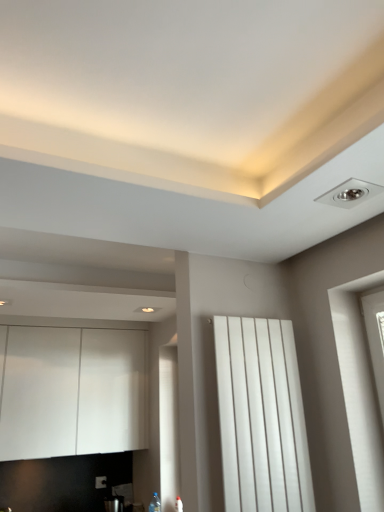
Question: Do you think white matte radiator at center is within white matte cabinet at left, or outside of it?

Choices:
 (A) inside
 (B) outside

Answer: (B)

Question: Is point (264, 428) positioned closer to the camera than point (3, 443)?

Choices:
 (A) farther
 (B) closer

Answer: (B)

Question: Looking at their shapes, would you say white matte radiator at center is wider or thinner than white matte cabinet at left?

Choices:
 (A) wide
 (B) thin

Answer: (B)

Question: Considering the positions of white matte cabinet at left and white matte radiator at center in the image, is white matte cabinet at left wider or thinner than white matte radiator at center?

Choices:
 (A) thin
 (B) wide

Answer: (B)

Question: Is white matte cabinet at left bigger or smaller than white matte radiator at center?

Choices:
 (A) big
 (B) small

Answer: (A)

Question: Is white matte cabinet at left inside or outside of white matte radiator at center?

Choices:
 (A) inside
 (B) outside

Answer: (B)

Question: From the image's perspective, relative to white matte radiator at center, is white matte cabinet at left above or below?

Choices:
 (A) below
 (B) above

Answer: (A)